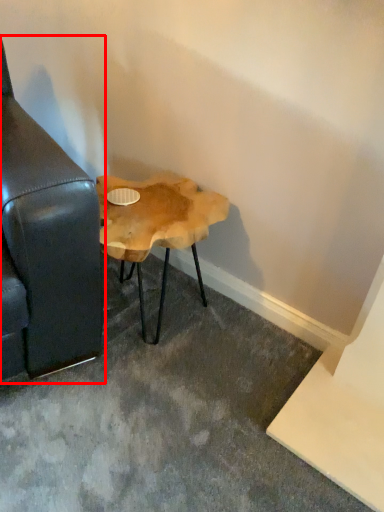
Question: From the image's perspective, where is studio couch (annotated by the red box) located in relation to table in the image?

Choices:
 (A) below
 (B) above

Answer: (B)